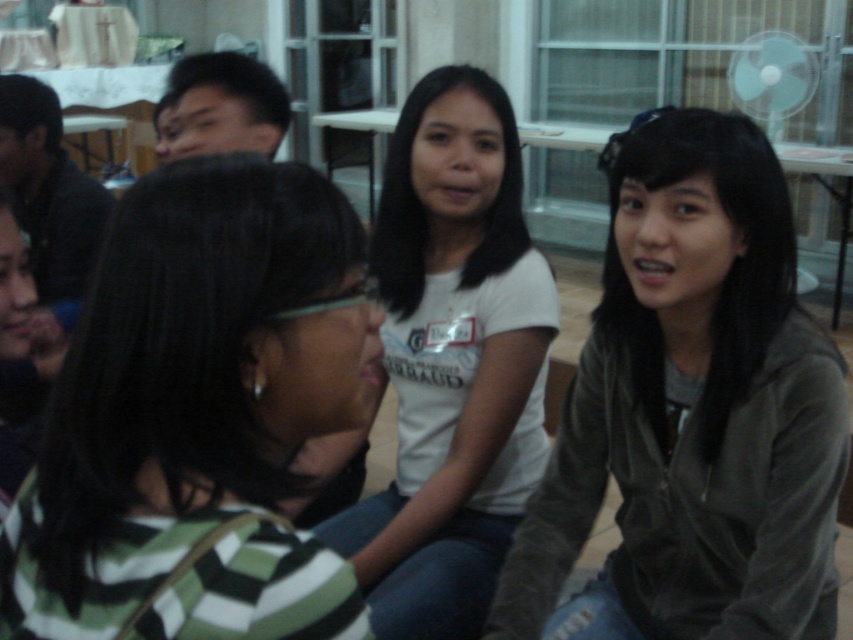
Is point (119, 561) positioned in front of point (431, 138)?

Yes, it is in front of point (431, 138).

Is green striped shirt at center above white matte shirt at center?

No.

Between point (354, 268) and point (434, 401), which one is positioned in front?

Point (354, 268)

Find the location of a particular element. green striped shirt at center is located at coordinates (198, 417).

Can you confirm if matte gray jacket at right is positioned to the right of white matte shirt at center?

Indeed, matte gray jacket at right is positioned on the right side of white matte shirt at center.

Which is behind, point (689, 636) or point (483, 188)?

Point (483, 188)

Where is `matte gray jacket at right`? This screenshot has height=640, width=853. matte gray jacket at right is located at coordinates (694, 406).

You are a GUI agent. You are given a task and a screenshot of the screen. Output one action in this format:
    pyautogui.click(x=<x>, y=<y>)
    Task: Click on the matte gray jacket at right
    This screenshot has width=853, height=640.
    Given the screenshot: What is the action you would take?
    pyautogui.click(x=694, y=406)

Is green striped shirt at center above matte gray jacket at right?

Yes.

Is green striped shirt at center further to the viewer compared to matte gray jacket at right?

No, it is in front of matte gray jacket at right.

Which is behind, point (354, 234) or point (634, 442)?

The point (634, 442) is more distant.

The height and width of the screenshot is (640, 853). I want to click on green striped shirt at center, so click(198, 417).